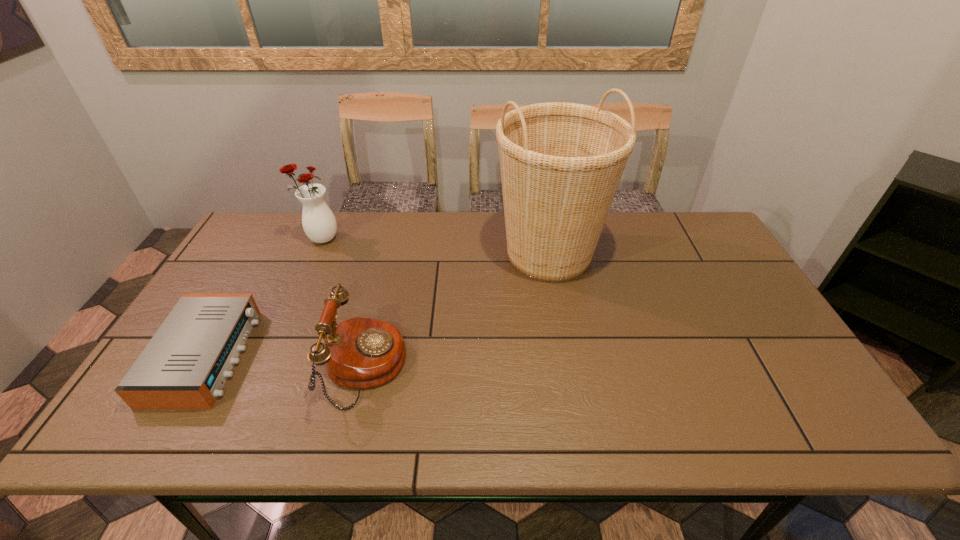
Identify the location of basket situated at the far edge. (561, 163).

At what (x,y) coordinates should I click in order to perform the action: click on vase that is at the far edge. Please return your answer as a coordinate pair (x, y). Image resolution: width=960 pixels, height=540 pixels. Looking at the image, I should click on (318, 221).

At what (x,y) coordinates should I click in order to perform the action: click on telephone situated at the near edge. Please return your answer as a coordinate pair (x, y). This screenshot has width=960, height=540. Looking at the image, I should click on (360, 353).

What are the coordinates of `radio receiver at the near edge` in the screenshot? It's located at (185, 365).

Identify the location of object that is at the left edge. (185, 365).

Image resolution: width=960 pixels, height=540 pixels. Identify the location of object that is at the near left corner. (185, 365).

This screenshot has width=960, height=540. In the image, there is a desktop. Find the location of `vacant space at the far edge`. vacant space at the far edge is located at coordinates (619, 235).

Identify the location of vacant position at the right edge of the desktop. [x=771, y=325].

This screenshot has width=960, height=540. In order to click on vacant space at the far right corner of the desktop in this screenshot , I will do `click(697, 254)`.

Find the location of a particular element. This screenshot has width=960, height=540. vacant area that lies between the radio receiver and the third shortest object is located at coordinates [x=263, y=298].